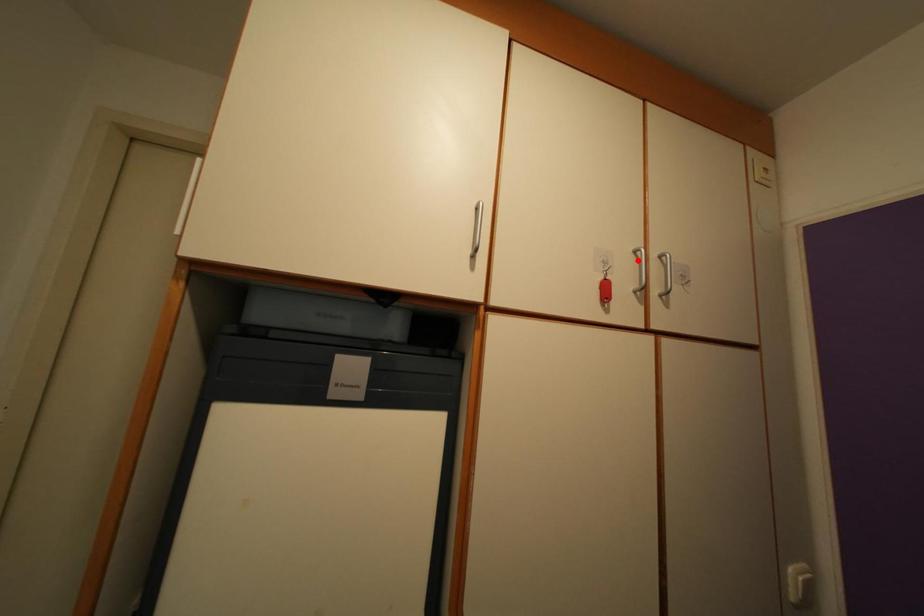
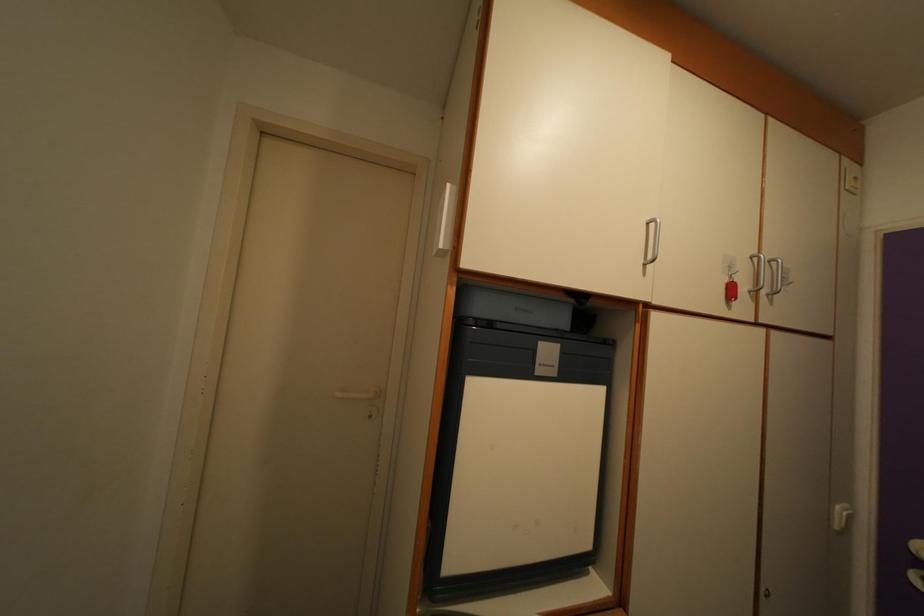
Where in the second image is the point corresponding to the highlighted location from the first image?

(755, 265)